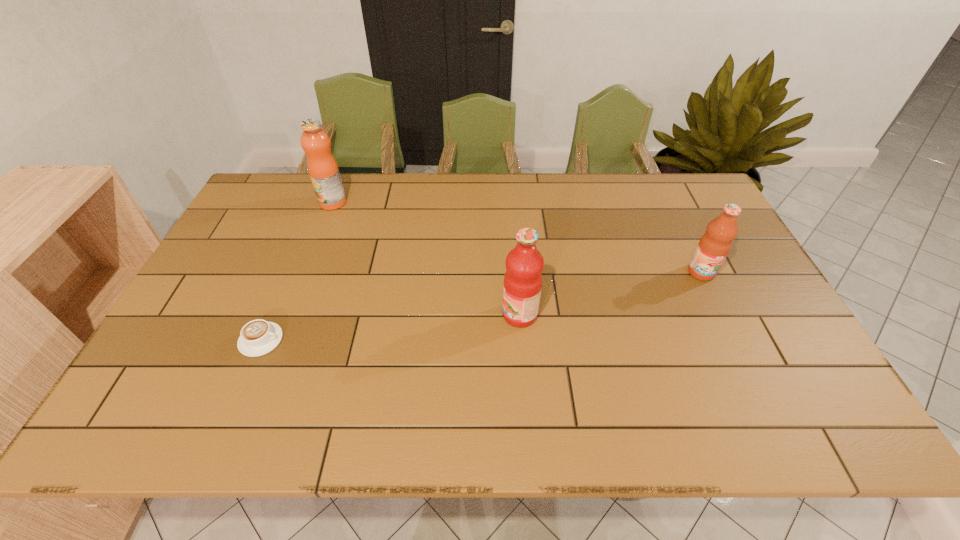
Identify the location of free point between the second object from right to left and the shortest object. (391, 327).

In order to click on vacant area that lies between the second object from right to left and the rightmost object in this screenshot , I will do `click(611, 294)`.

In order to click on free space between the shortest object and the nearest fruit juice in this screenshot , I will do `click(391, 327)`.

Image resolution: width=960 pixels, height=540 pixels. I want to click on free area in between the shortest object and the second fruit juice from right to left, so click(x=391, y=327).

This screenshot has height=540, width=960. In order to click on free spot between the third tallest object and the second fruit juice from left to right in this screenshot , I will do `click(611, 294)`.

Locate an element on the screen. This screenshot has width=960, height=540. object that is the closest to the nearest fruit juice is located at coordinates (713, 247).

You are a GUI agent. You are given a task and a screenshot of the screen. Output one action in this format:
    pyautogui.click(x=<x>, y=<y>)
    Task: Click on the object identified as the closest to the rightmost fruit juice
    The width and height of the screenshot is (960, 540).
    Given the screenshot: What is the action you would take?
    pyautogui.click(x=524, y=264)

Choose which fruit juice is the nearest neighbor to the second fruit juice from right to left. Please provide its 2D coordinates. Your answer should be formatted as a tuple, i.e. [(x, y)], where the tuple contains the x and y coordinates of a point satisfying the conditions above.

[(713, 247)]

Image resolution: width=960 pixels, height=540 pixels. Identify the location of fruit juice that is the second closest one to the farthest object. (713, 247).

Where is `vacant space that satisfies the following two spatial constraints: 1. on the front label of the rightmost object; 2. with the handle on the right side of the cappuccino`? vacant space that satisfies the following two spatial constraints: 1. on the front label of the rightmost object; 2. with the handle on the right side of the cappuccino is located at coordinates (734, 340).